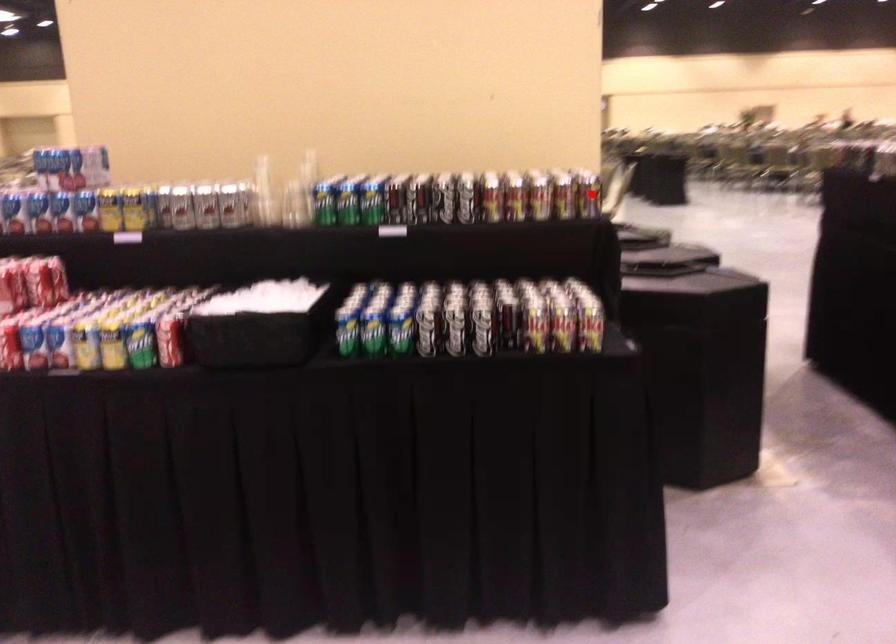
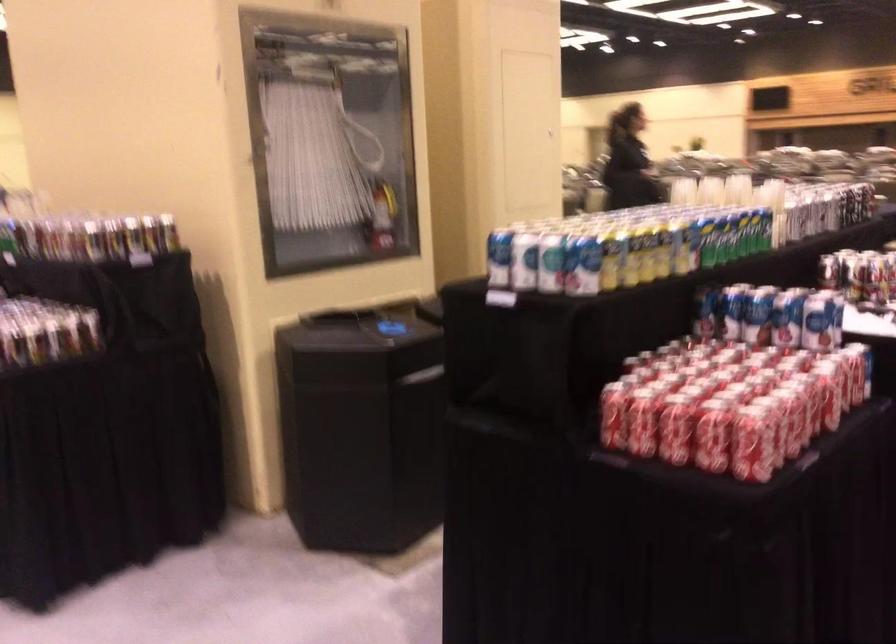
Question: I am providing you with two images of the same scene from different viewpoints. Image1 has a red point marked. In image2, the corresponding 3D location appears at what relative position? Reply with the corresponding letter.

Choices:
 (A) Closer
 (B) Farther

Answer: (B)